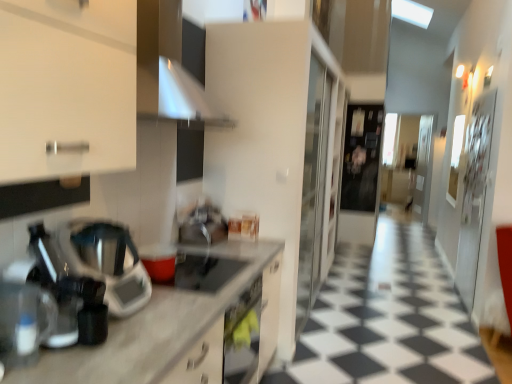
Where is `vacant space underneath satin silver exhaust hood at upper center (from a real-world perspective)`? The width and height of the screenshot is (512, 384). vacant space underneath satin silver exhaust hood at upper center (from a real-world perspective) is located at coordinates (200, 264).